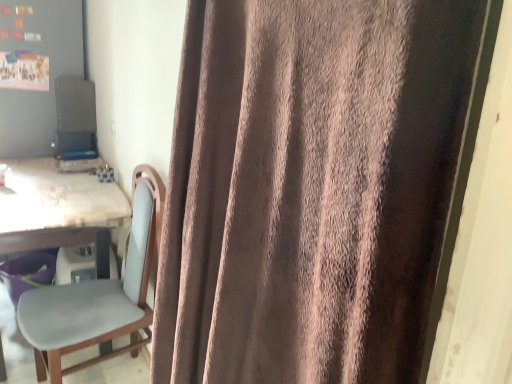
Locate an element on the screen. This screenshot has width=512, height=384. empty space that is ontop of wooden table at left (from a real-world perspective) is located at coordinates (53, 184).